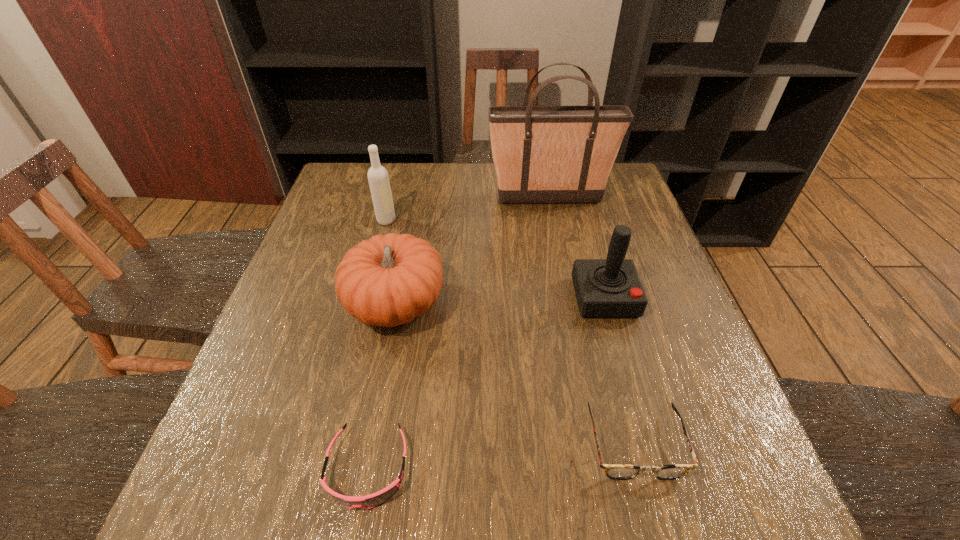
You are a GUI agent. You are given a task and a screenshot of the screen. Output one action in this format:
    pyautogui.click(x=<x>, y=<y>)
    Task: Click on the free space located 0.100m on the back of the fourth tallest object
    The height and width of the screenshot is (540, 960).
    Given the screenshot: What is the action you would take?
    pyautogui.click(x=406, y=244)

Where is `object located at the far edge`? This screenshot has height=540, width=960. object located at the far edge is located at coordinates (542, 154).

At what (x,y) coordinates should I click in order to perform the action: click on spectacles situated at the near edge. Please return your answer as a coordinate pair (x, y). The image size is (960, 540). Looking at the image, I should click on (620, 471).

At what (x,y) coordinates should I click in order to perform the action: click on goggles that is at the near edge. Please return your answer as a coordinate pair (x, y). Looking at the image, I should click on (370, 501).

The image size is (960, 540). I want to click on object at the left edge, so coord(388,280).

Locate an element on the screen. This screenshot has height=540, width=960. shopping bag that is at the right edge is located at coordinates (542, 154).

Where is `joystick positioned at the right edge`? The width and height of the screenshot is (960, 540). joystick positioned at the right edge is located at coordinates (605, 288).

Identify the location of spectacles that is at the right edge. (620, 471).

Locate an element on the screen. Image resolution: width=960 pixels, height=540 pixels. object that is at the far right corner is located at coordinates (542, 154).

Find the location of a particular element. object that is at the near right corner is located at coordinates (620, 471).